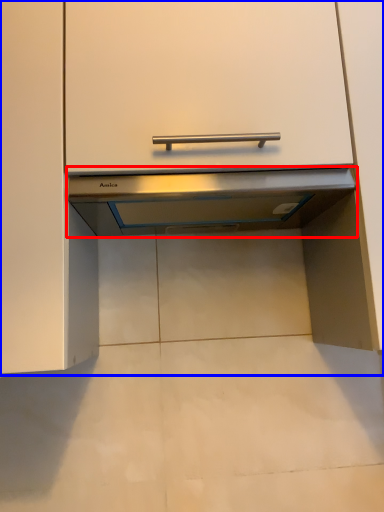
Question: Which point is closer to the camera, exhaust hood (highlighted by a red box) or cabinetry (highlighted by a blue box)?

Choices:
 (A) exhaust hood
 (B) cabinetry

Answer: (B)